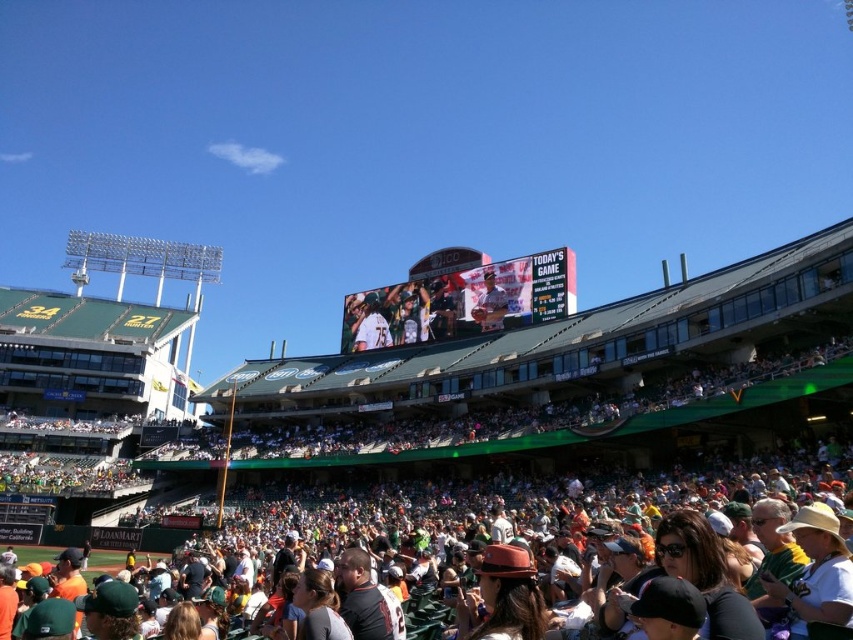
Does white digital scoreboard at center have a lesser width compared to matte gray baseball cap at center?

In fact, white digital scoreboard at center might be wider than matte gray baseball cap at center.

Is white digital scoreboard at center below matte gray baseball cap at center?

Incorrect, white digital scoreboard at center is not positioned below matte gray baseball cap at center.

Is point (560, 304) more distant than point (474, 314)?

No, it is in front of (474, 314).

Identify the location of white digital scoreboard at center. The height and width of the screenshot is (640, 853). (461, 301).